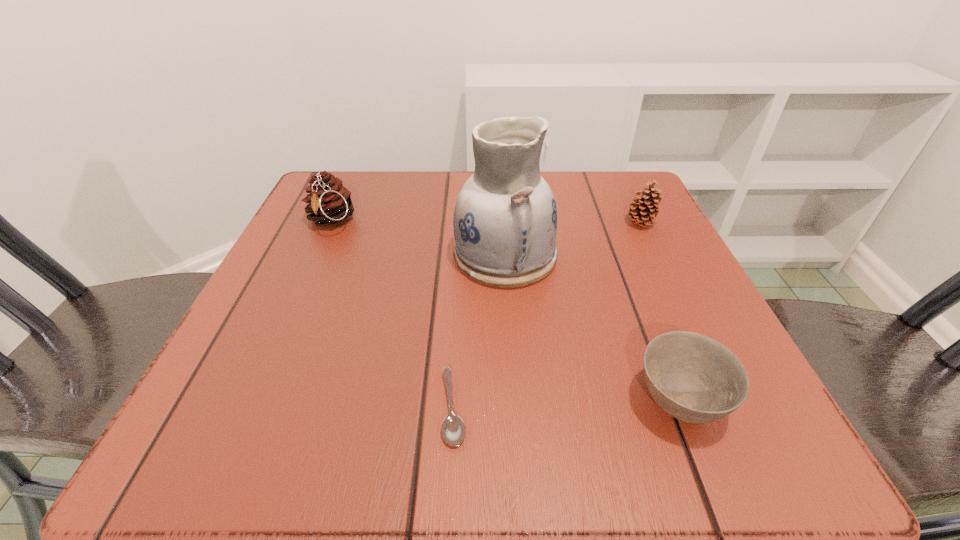
This screenshot has width=960, height=540. In the image, there is a desktop. Identify the location of free space at the far edge. (574, 229).

Locate an element on the screen. The image size is (960, 540). vacant space at the near edge is located at coordinates (618, 458).

Locate an element on the screen. vacant space at the left edge of the desktop is located at coordinates (291, 348).

This screenshot has width=960, height=540. In order to click on free spot at the right edge of the desktop in this screenshot , I will do `click(641, 248)`.

The width and height of the screenshot is (960, 540). In the image, there is a desktop. Find the location of `vacant area at the near left corner`. vacant area at the near left corner is located at coordinates (221, 463).

Where is `vacant space at the far right corner of the desktop`? This screenshot has height=540, width=960. vacant space at the far right corner of the desktop is located at coordinates 612,226.

In the image, there is a desktop. Where is `vacant space at the near right corner`? Image resolution: width=960 pixels, height=540 pixels. vacant space at the near right corner is located at coordinates (663, 434).

Where is `unoccupied area between the third shortest object and the tallest object`? unoccupied area between the third shortest object and the tallest object is located at coordinates (573, 239).

What are the coordinates of `vacant space that is in between the right pinecone and the second shortest object` in the screenshot? It's located at (660, 312).

Where is `vacant area that lies between the leftmost object and the tallest object`? This screenshot has width=960, height=540. vacant area that lies between the leftmost object and the tallest object is located at coordinates (418, 238).